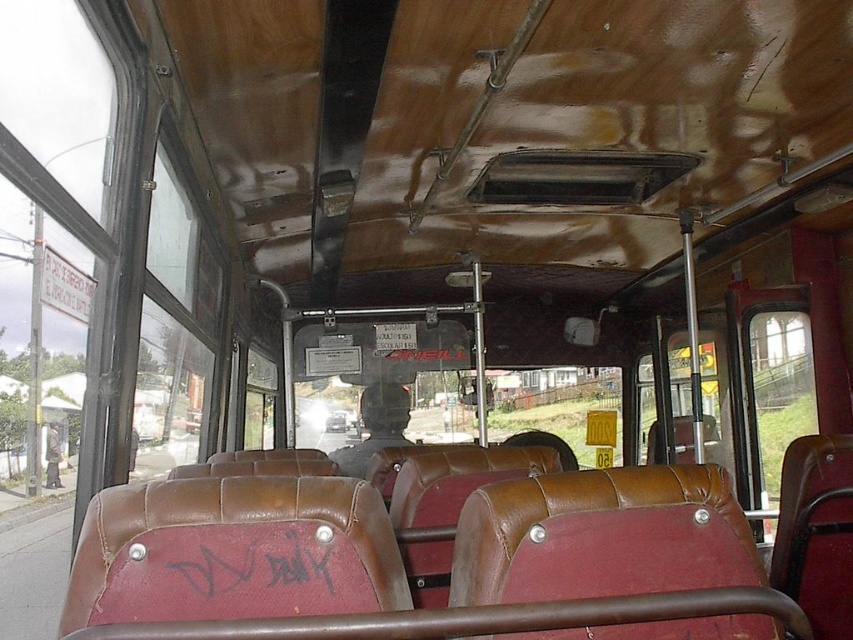
Which is more to the right, black graffiti at center or matte black helmet at center?

black graffiti at center is more to the right.

Measure the distance between point (x=206, y=564) and camera.

Point (x=206, y=564) and camera are 3.99 feet apart from each other.

This screenshot has width=853, height=640. In order to click on black graffiti at center in this screenshot , I will do `click(258, 561)`.

Between transparent glass window at left and matte black helmet at center, which one appears on the right side from the viewer's perspective?

From the viewer's perspective, matte black helmet at center appears more on the right side.

Which is more to the left, transparent glass window at left or matte black helmet at center?

Positioned to the left is transparent glass window at left.

What do you see at coordinates (175, 323) in the screenshot? This screenshot has width=853, height=640. I see `transparent glass window at left` at bounding box center [175, 323].

Where is `transparent glass window at left`? transparent glass window at left is located at coordinates (175, 323).

Is transparent glass window at left positioned behind black graffiti at center?

That is True.

Which of these two, transparent glass window at left or black graffiti at center, stands taller?

With more height is transparent glass window at left.

Image resolution: width=853 pixels, height=640 pixels. What are the coordinates of `transparent glass window at left` in the screenshot? It's located at (175, 323).